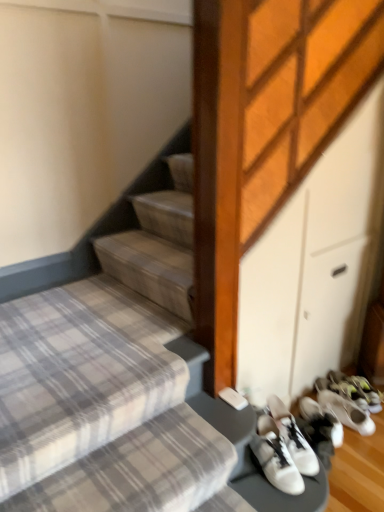
Find the location of a particular element. The image size is (384, 512). empty space that is ontop of white leather sneakers at lower right, arranged as the first footwear when viewed from the left is located at coordinates (313, 426).